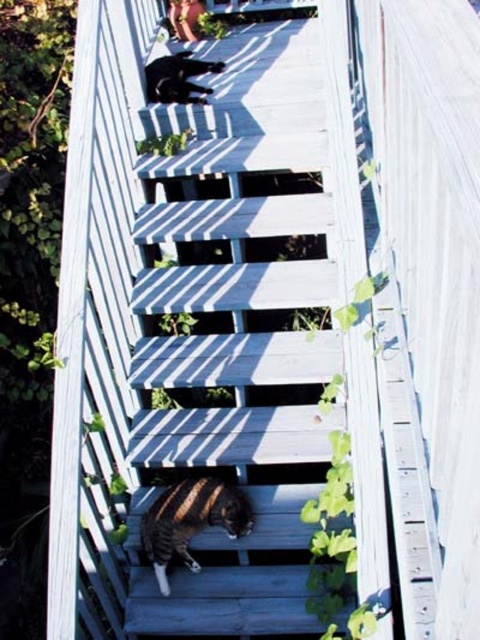
You are standing at the base of the stairs and want to reach the top step. There are two points marked on the stairs, point (148, 468) and point (186, 483). Which point is closer to you?

Point (148, 468) is closer to you because it is further to the viewer than point (186, 483).

You are standing at the bottom of the stairs and want to place a small potted plant on the step where the tabby fur cat at center is located. According to the image, where exactly should you place the plant?

The tabby fur cat at center is located at point 0.814 on the x axis and 0.398 on the y axis, so place the plant at those coordinates to ensure it is on the same step as the cat.

You are standing at the bottom of the stairs and see both the tabby fur cat at center and the shiny black cat at upper center. Which cat is positioned to the right of the other?

The tabby fur cat at center is to the right of the shiny black cat at upper center.